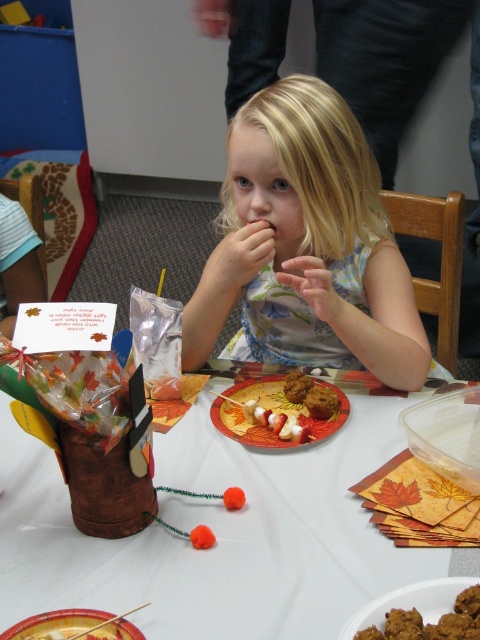
Question: Which point is farther to the camera?

Choices:
 (A) white paper plate at center
 (B) wooden stick at center
 (C) blonde hair at center

Answer: (C)

Question: Does blonde hair at center appear under brown matte cookies at center?

Choices:
 (A) no
 (B) yes

Answer: (A)

Question: Which point is closer to the camera taking this photo?

Choices:
 (A) (237, 237)
 (B) (10, 637)
 (C) (277, 400)
 (D) (167, 561)

Answer: (B)

Question: Does white paper plate at center appear on the left side of matte skin hand at center?

Choices:
 (A) no
 (B) yes

Answer: (B)

Question: Does wooden stick at center have a smaller size compared to smooth skin hand at center?

Choices:
 (A) no
 (B) yes

Answer: (B)

Question: Which point appears farthest from the camera in this image?

Choices:
 (A) (454, 595)
 (B) (80, 637)
 (C) (278, 442)
 (D) (255, 230)

Answer: (D)